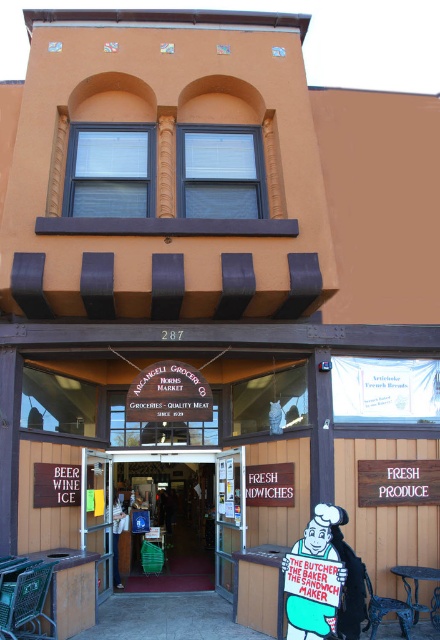
Question: Where is cartoonish painted figure at center located in relation to white cotton shirt at center in the image?

Choices:
 (A) right
 (B) left

Answer: (A)

Question: Which point appears closest to the camera in this image?

Choices:
 (A) (120, 522)
 (B) (360, 593)
 (C) (252, 324)

Answer: (B)

Question: Among these points, which one is nearest to the camera?

Choices:
 (A) (120, 588)
 (B) (333, 634)
 (C) (175, 492)
 (D) (304, 522)

Answer: (B)

Question: Is green plastic basket at center below cartoonish painted figure at center?

Choices:
 (A) yes
 (B) no

Answer: (A)

Question: Does green plastic basket at center have a smaller size compared to cartoonish painted figure at center?

Choices:
 (A) no
 (B) yes

Answer: (B)

Question: Which point is farther from the camera taking this photo?

Choices:
 (A) (333, 611)
 (B) (176, 515)
 (C) (392, 362)

Answer: (B)